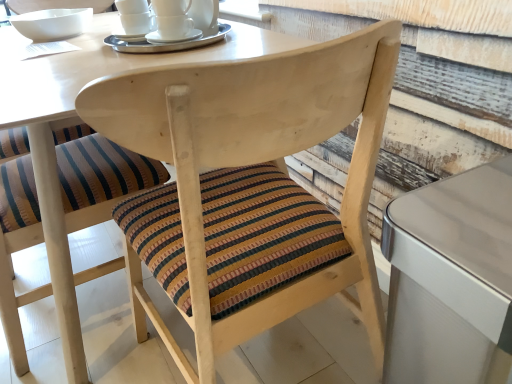
At what (x,y) coordinates should I click in order to perform the action: click on vacant area that is in front of white ceramic cups at upper center. Please return your answer as a coordinate pair (x, y). Looking at the image, I should click on (99, 66).